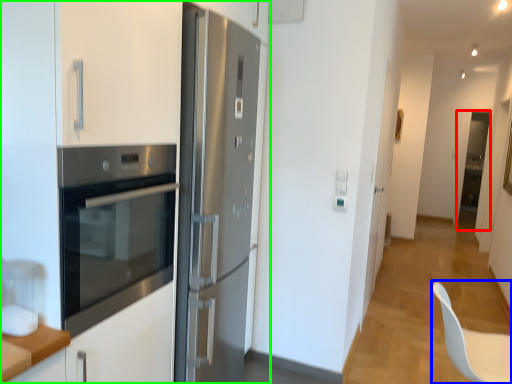
Question: Based on their relative distances, which object is nearer to glass door (highlighted by a red box)? Choose from swivel chair (highlighted by a blue box) and cabinetry (highlighted by a green box).

Choices:
 (A) swivel chair
 (B) cabinetry

Answer: (A)